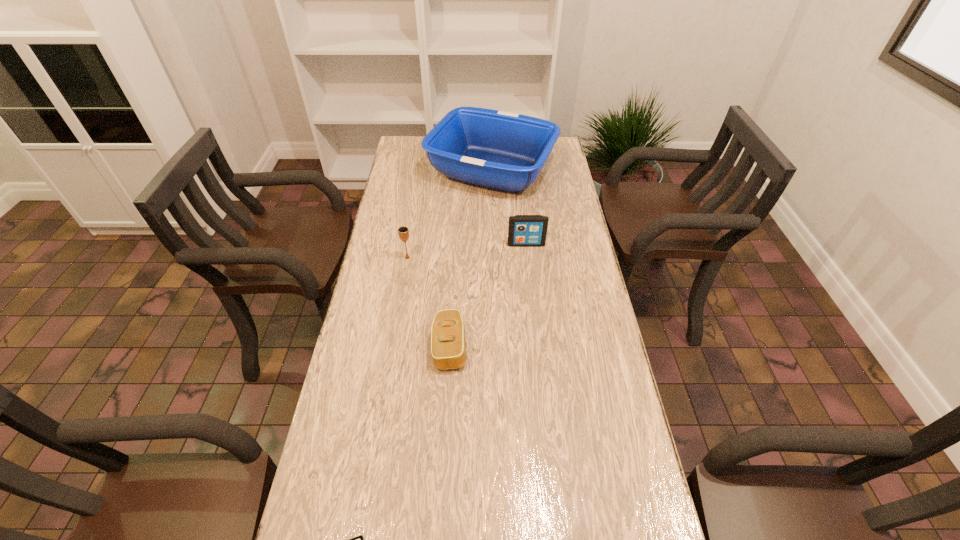
Locate an element on the screen. The image size is (960, 540). vacant area located 0.350m on the zipper side of the fourth farthest object is located at coordinates (591, 347).

Identify the location of object that is at the far edge. This screenshot has height=540, width=960. (505, 151).

This screenshot has height=540, width=960. Identify the location of tray located in the left edge section of the desktop. (505, 151).

In order to click on chalice at the left edge in this screenshot , I will do `click(403, 231)`.

The height and width of the screenshot is (540, 960). I want to click on tray located in the right edge section of the desktop, so click(505, 151).

Where is `iPod present at the right edge`? Image resolution: width=960 pixels, height=540 pixels. iPod present at the right edge is located at coordinates pyautogui.click(x=523, y=230).

Find the location of a particular element. object present at the far left corner is located at coordinates (505, 151).

Identify the location of object that is at the far right corner. (505, 151).

This screenshot has height=540, width=960. In the image, there is a desktop. Identify the location of vacant space at the left edge. (375, 479).

The width and height of the screenshot is (960, 540). In the image, there is a desktop. What are the coordinates of `free region at the right edge` in the screenshot? It's located at (543, 211).